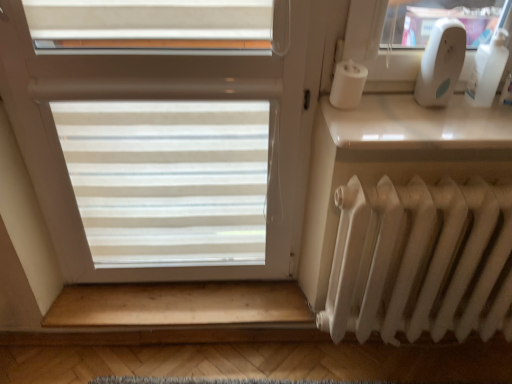
Where is `empty space that is ontop of wooden at lower (from a real-world perspective)`? The width and height of the screenshot is (512, 384). empty space that is ontop of wooden at lower (from a real-world perspective) is located at coordinates (168, 290).